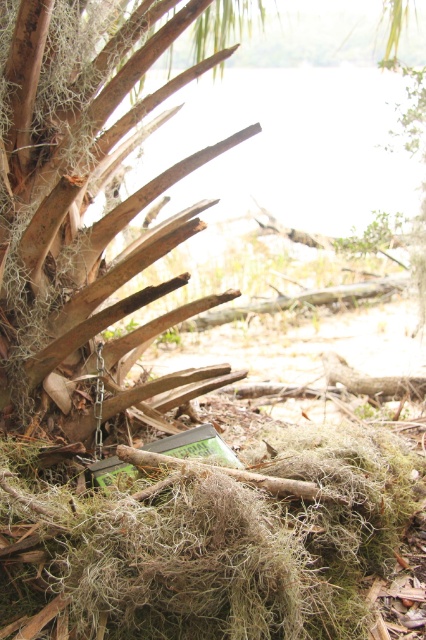
Question: Can you confirm if brown rough palm tree at center is positioned to the right of transparent water at upper center?

Choices:
 (A) yes
 (B) no

Answer: (B)

Question: Observing the image, what is the correct spatial positioning of brown rough palm tree at center in reference to transparent water at upper center?

Choices:
 (A) right
 (B) left

Answer: (B)

Question: Which is farther from the brown rough palm tree at center?

Choices:
 (A) transparent water at upper center
 (B) green plastic canister at lower center

Answer: (A)

Question: Does brown rough palm tree at center have a smaller size compared to transparent water at upper center?

Choices:
 (A) yes
 (B) no

Answer: (A)

Question: Based on their relative distances, which object is farther from the green plastic canister at lower center?

Choices:
 (A) brown rough palm tree at center
 (B) transparent water at upper center

Answer: (B)

Question: Which point is closer to the camera?

Choices:
 (A) pos(31,64)
 (B) pos(141,157)
 (C) pos(137,612)

Answer: (C)